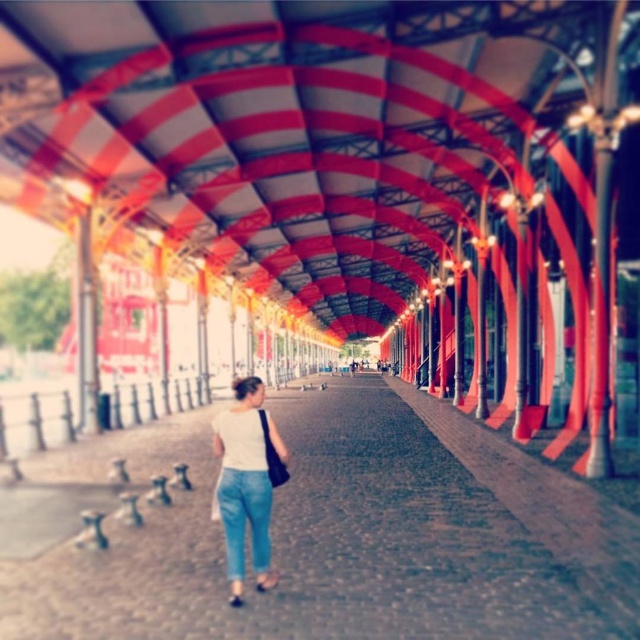
You are standing on the walkway and notice both the brown cobblestone pavement at center and the blue denim jeans at center. Which object is located below the other?

The brown cobblestone pavement at center is positioned under the blue denim jeans at center.

You are standing on the brown cobblestone pavement at center and want to walk towards the red and white striped beams in the distance. There is a point marked at coordinates [324,532]. Is this point on the path you should take to reach the beams?

Yes, the point marked at coordinates [324,532] is on the brown cobblestone pavement at center, which is the path leading towards the red and white striped beams in the distance.